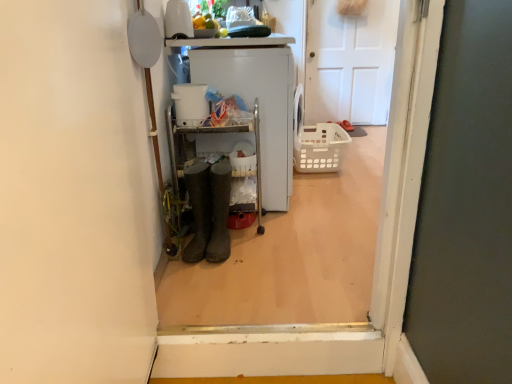
Where is `free space in front of matte rubber boots at center`? Image resolution: width=512 pixels, height=384 pixels. free space in front of matte rubber boots at center is located at coordinates (238, 264).